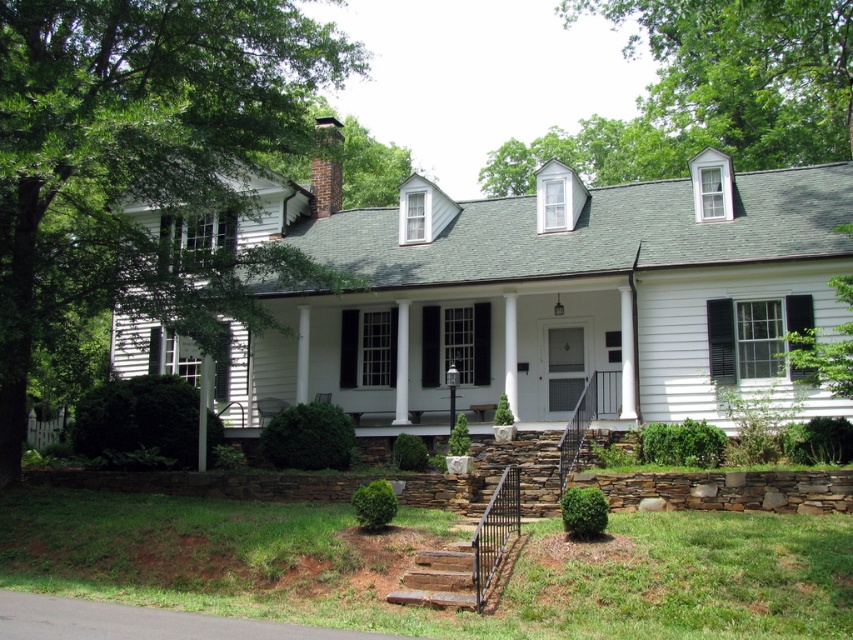
You are standing in front of the house and want to compare the height of the white painted wood shutter at center and the brown brick chimney at upper center. Which one is taller?

The brown brick chimney at upper center is taller than the white painted wood shutter at center.

You are standing at the base of the house steps and want to reach the brown brick chimney at upper center. There is a white painted wood shutter at center in your path. Can you walk straight ahead to reach the chimney without going around the shutter?

The white painted wood shutter at center is 10.98 meters away from the brown brick chimney at upper center. Since the shutter is directly in the path towards the chimney, you would need to go around it to reach the chimney.

You are standing at the base of the wooden stairs at lower center and want to reach the brown brick chimney at upper center. Which direction should you move to get closer to the chimney?

You should move forward towards the house because the wooden stairs at lower center are closer to the viewer than the brown brick chimney at upper center, meaning the chimney is further away and located behind the stairs.